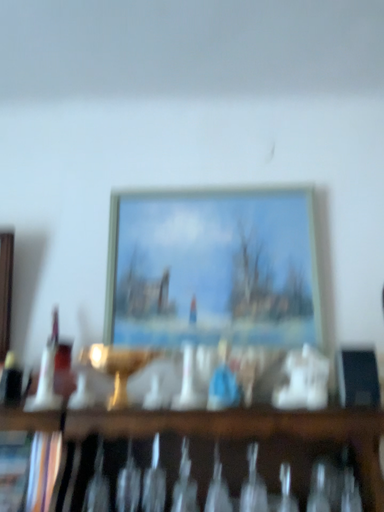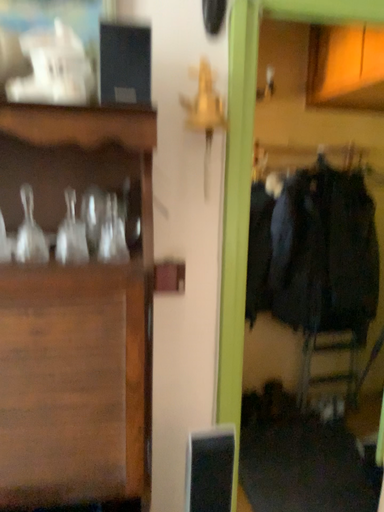
Question: How did the camera likely rotate when shooting the video?

Choices:
 (A) rotated left
 (B) rotated right

Answer: (B)